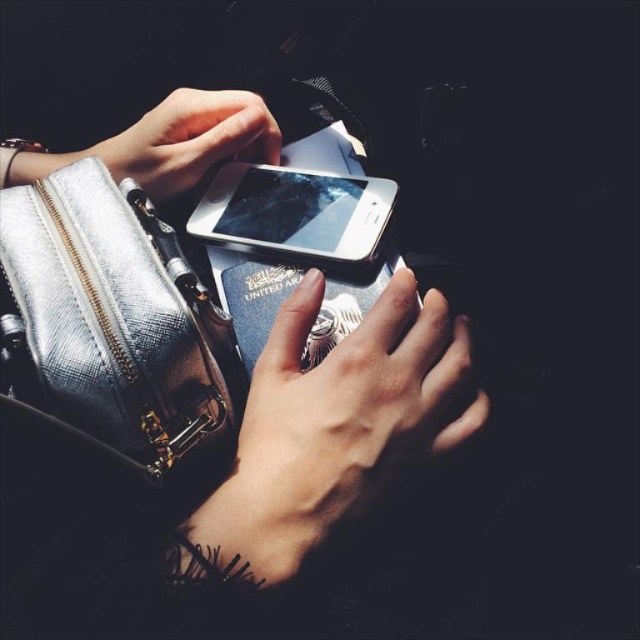
You are trying to decide which item to place in your pocket. The metallic silver handbag at left and the shiny silver phone at center are both silver. Which one is thinner and can fit better in your pocket?

The metallic silver handbag at left is thinner than the shiny silver phone at center, so it can fit better in your pocket.

What are the coordinates of the shiny silver phone at center?

The coordinates of the shiny silver phone at center are at point (294, 212).

You are trying to decide which item to place in your pocket. The metallic silver handbag at left and the shiny silver phone at center are both in view. Which item can fit into your pocket based on their sizes?

The shiny silver phone at center can fit into your pocket since it is smaller in height than the metallic silver handbag at left.